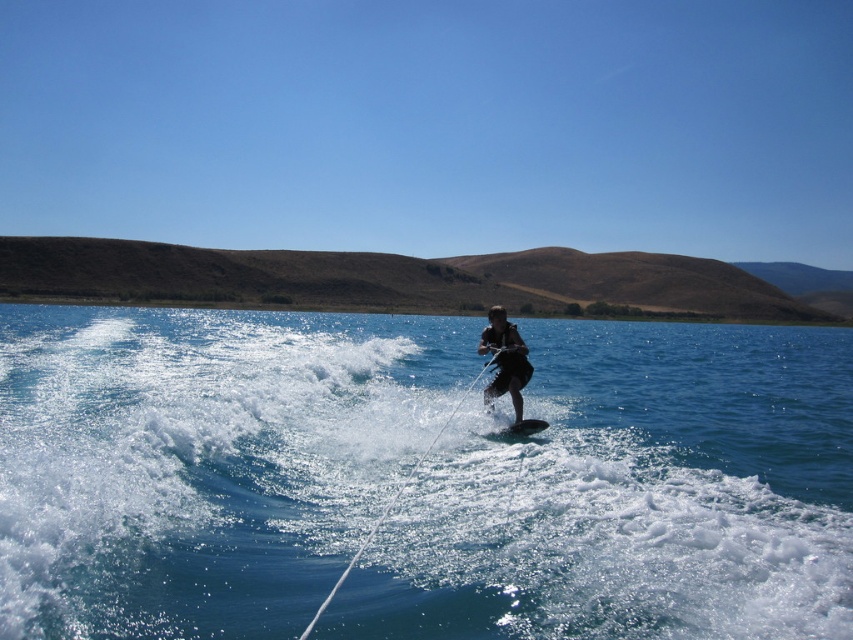
Which is below, dark blue wetsuit at center or black rubber surfboard at center?

black rubber surfboard at center is below.

How much distance is there between dark blue wetsuit at center and black rubber surfboard at center?

The distance of dark blue wetsuit at center from black rubber surfboard at center is 1.31 meters.

Identify the location of dark blue wetsuit at center. Image resolution: width=853 pixels, height=640 pixels. point(505,358).

Is point (602, 355) in front of point (527, 429)?

No, (602, 355) is behind (527, 429).

What do you see at coordinates (631, 497) in the screenshot? I see `clear blue water at center` at bounding box center [631, 497].

Who is more forward, (213, 573) or (537, 419)?

Point (213, 573) is more forward.

You are a GUI agent. You are given a task and a screenshot of the screen. Output one action in this format:
    pyautogui.click(x=<x>, y=<y>)
    Task: Click on the clear blue water at center
    
    Given the screenshot: What is the action you would take?
    pyautogui.click(x=631, y=497)

Does clear blue water at center have a greater height compared to dark blue wetsuit at center?

Indeed, clear blue water at center has a greater height compared to dark blue wetsuit at center.

Which is more to the right, clear blue water at center or dark blue wetsuit at center?

From the viewer's perspective, clear blue water at center appears more on the right side.

You are a GUI agent. You are given a task and a screenshot of the screen. Output one action in this format:
    pyautogui.click(x=<x>, y=<y>)
    Task: Click on the clear blue water at center
    Image resolution: width=853 pixels, height=640 pixels.
    Given the screenshot: What is the action you would take?
    pyautogui.click(x=631, y=497)

I want to click on clear blue water at center, so click(x=631, y=497).